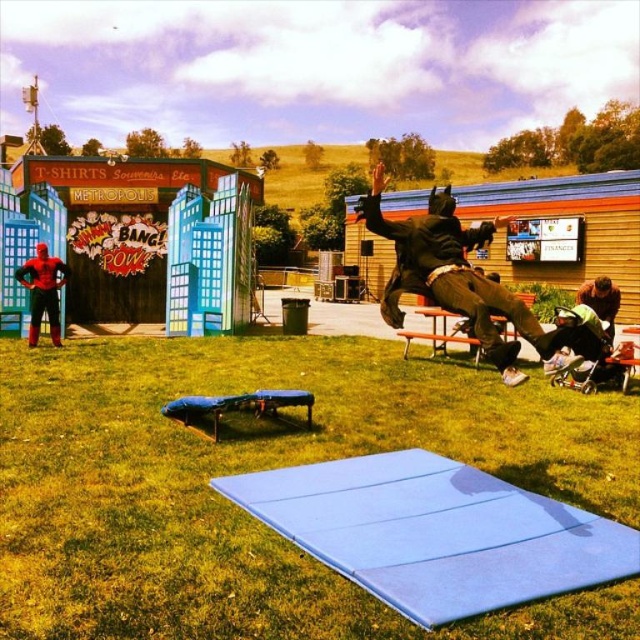
Is blue foam mat at center smaller than dark brown leather jacket at upper center?

Yes.

Who is taller, blue foam mat at center or dark brown leather jacket at upper center?

dark brown leather jacket at upper center

Is point (339, 524) more distant than point (419, 278)?

No, (339, 524) is closer to viewer.

The width and height of the screenshot is (640, 640). Identify the location of blue foam mat at center. (435, 532).

Is point (560, 529) behind point (48, 276)?

No, it is not.

Is blue foam mat at center below shiny red suit at lower left?

Yes.

Which is in front, point (436, 456) or point (44, 252)?

Positioned in front is point (436, 456).

At what (x,y) coordinates should I click in order to perform the action: click on blue foam mat at center. Please return your answer as a coordinate pair (x, y). The width and height of the screenshot is (640, 640). Looking at the image, I should click on (435, 532).

Can you confirm if dark brown leather jacket at upper center is bigger than shiny red suit at lower left?

Yes.

Between dark brown leather jacket at upper center and shiny red suit at lower left, which one is positioned higher?

dark brown leather jacket at upper center is higher up.

Locate an element on the screen. This screenshot has height=640, width=640. dark brown leather jacket at upper center is located at coordinates (454, 276).